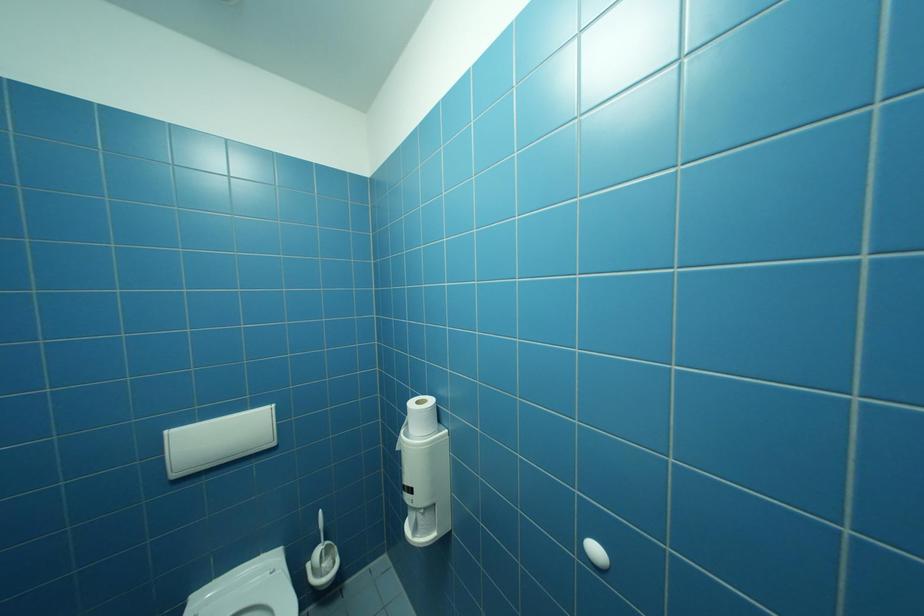
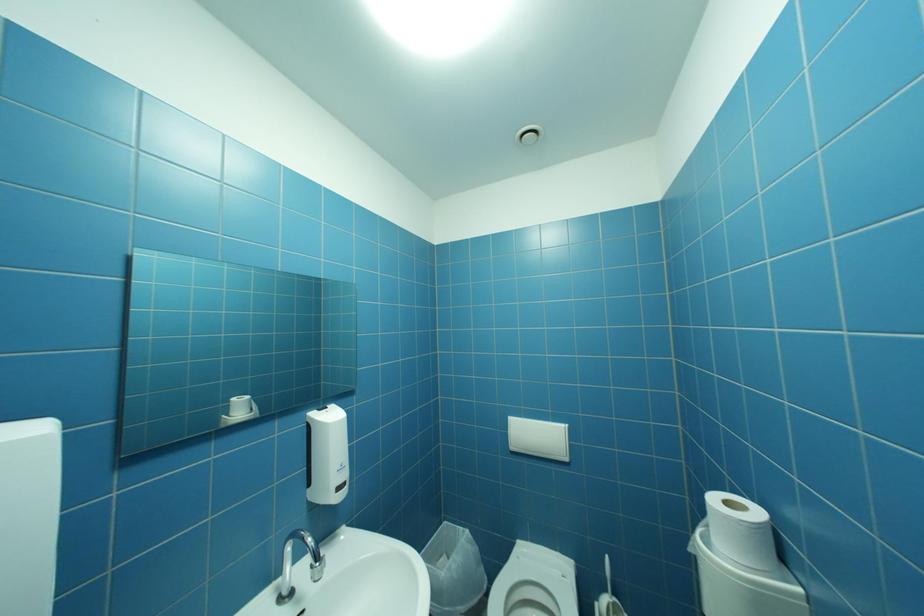
Question: The camera is either moving clockwise (left) or counter-clockwise (right) around the object. The first image is from the beginning of the video and the second image is from the end. Is the camera moving left or right when shooting the video?

Choices:
 (A) Left
 (B) Right

Answer: (B)